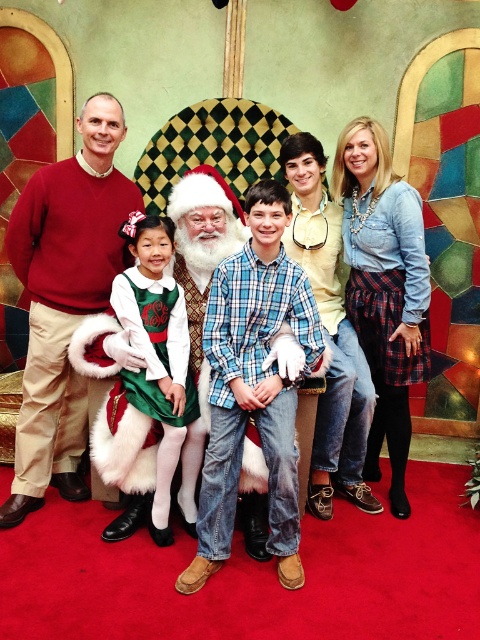
Question: Which point is farther from the camera taking this photo?

Choices:
 (A) (37, 461)
 (B) (219, 502)
 (C) (29, 403)

Answer: (A)

Question: Can you confirm if red sweater at left is bigger than blue plaid shirt at center?

Choices:
 (A) yes
 (B) no

Answer: (A)

Question: Which object is the farthest from the matte black laptop at center?

Choices:
 (A) red sweater at left
 (B) white fluffy santa at center
 (C) blue plaid shirt at center

Answer: (C)

Question: Which of the following is the farthest from the observer?

Choices:
 (A) blue plaid shirt at center
 (B) red sweater at left
 (C) matte black laptop at center

Answer: (B)

Question: Is matte black laptop at center wider than green satin dress at center?

Choices:
 (A) yes
 (B) no

Answer: (A)

Question: Can you confirm if matte black laptop at center is thinner than red sweater at left?

Choices:
 (A) no
 (B) yes

Answer: (B)